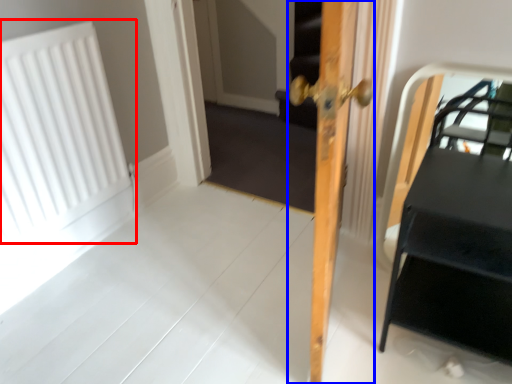
Question: Among these objects, which one is nearest to the camera, radiator (highlighted by a red box) or door (highlighted by a blue box)?

Choices:
 (A) radiator
 (B) door

Answer: (B)